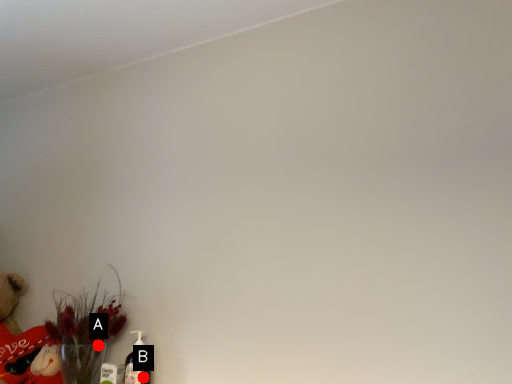
Question: Two points are circled on the image, labeled by A and B beside each circle. Which of the following is the closest to the observer?

Choices:
 (A) A is closer
 (B) B is closer

Answer: (B)